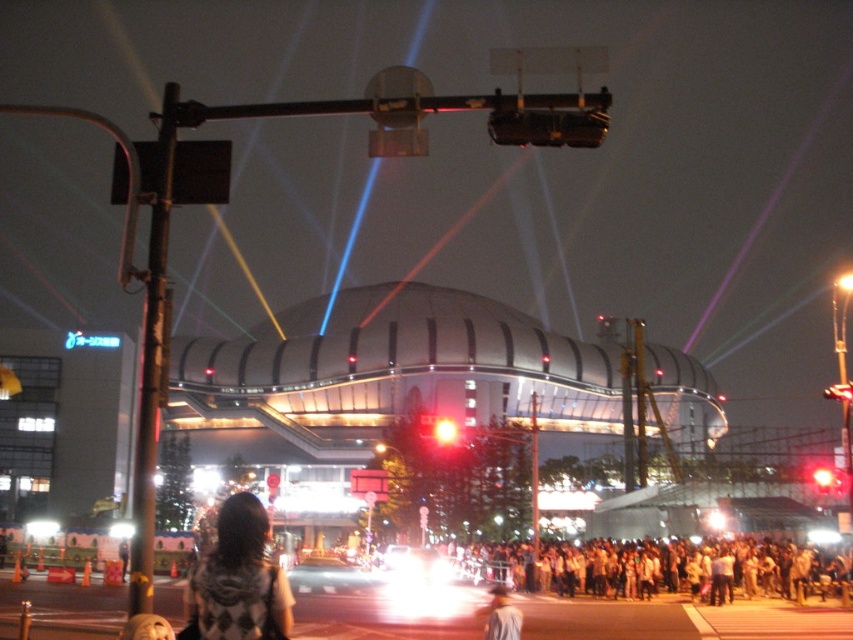
Question: Which point appears farthest from the camera in this image?

Choices:
 (A) [x=849, y=394]
 (B) [x=151, y=147]
 (C) [x=250, y=564]

Answer: (A)

Question: Which of the following is the closest to the observer?

Choices:
 (A) (256, 625)
 (B) (827, 387)

Answer: (A)

Question: Does red glass traffic light at center appear over red glass traffic light at upper center?

Choices:
 (A) no
 (B) yes

Answer: (A)

Question: Is plaid scarf at lower center below bright red light at center?

Choices:
 (A) no
 (B) yes

Answer: (B)

Question: Which point is farther from the camera taking this photo?

Choices:
 (A) (843, 394)
 (B) (442, 440)
 (C) (236, 520)
 (D) (189, 198)

Answer: (B)

Question: Considering the relative positions of white cotton crowd at lower right and light brown fabric jacket at center in the image provided, where is white cotton crowd at lower right located with respect to light brown fabric jacket at center?

Choices:
 (A) left
 (B) right

Answer: (B)